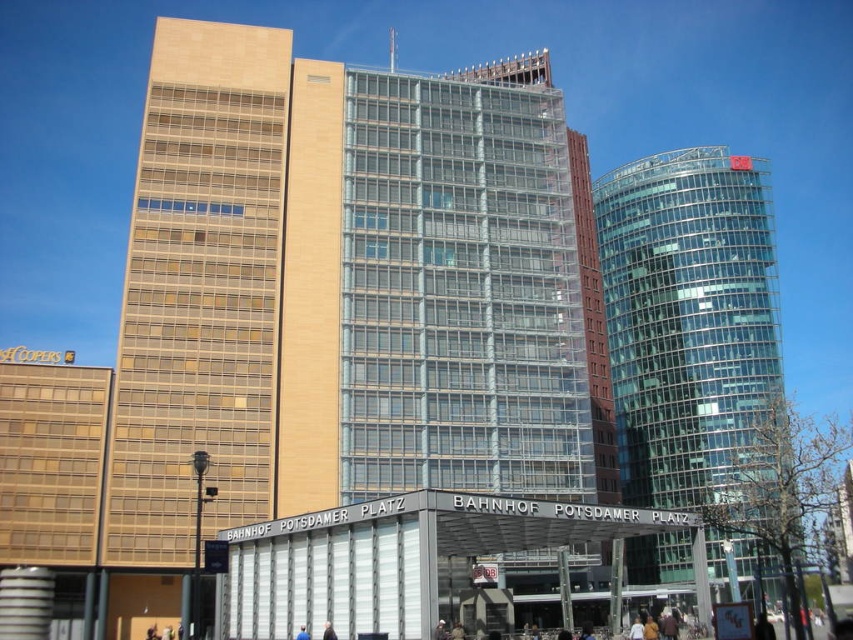
You are a photographer standing at the entrance of the Bahnhof Potsdamer Platz. You see a dark blue fabric jacket at center and a blue fabric person at lower center in your viewfinder. Which object is narrower in your frame?

The dark blue fabric jacket at center is narrower than the blue fabric person at lower center.

You are standing at the entrance of Bahnhof Potsdamer Platz and see the beige glass building at center and the blue fabric person at lower center. Which object is closer to your right side?

The beige glass building at center is positioned on the right side of blue fabric person at lower center, so if you are facing the beige glass building at center, the beige glass building at center would be to your right side.